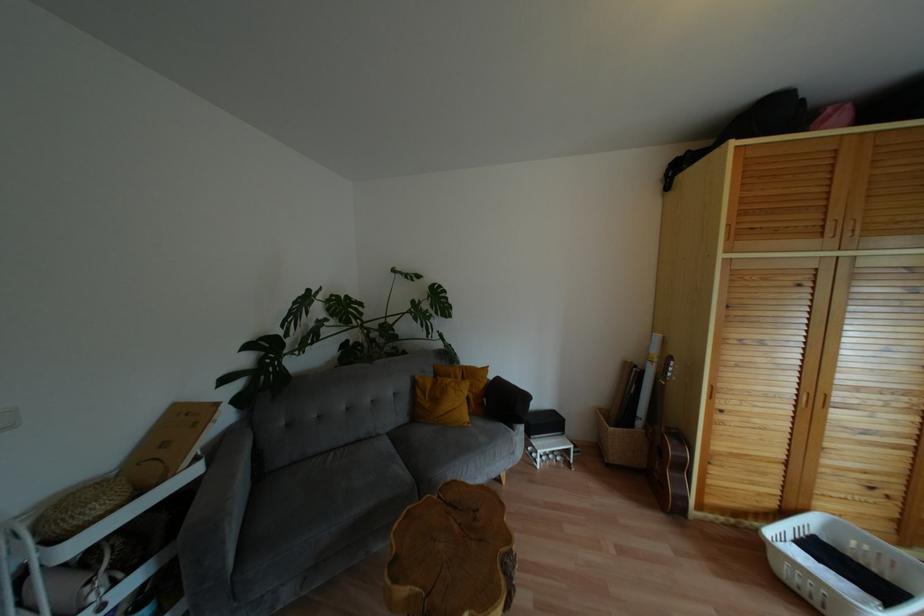
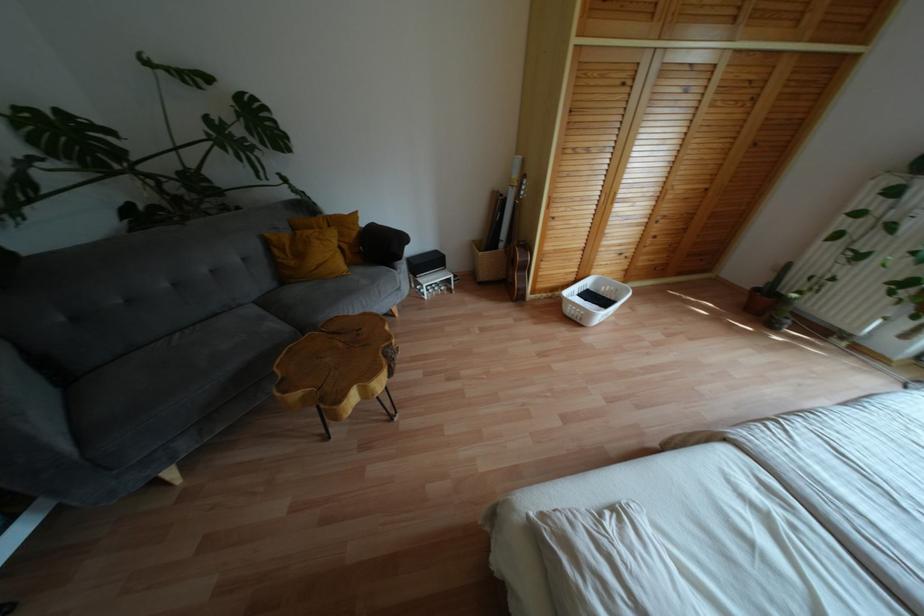
Where in the second image is the point corresponding to point 484,369 from the first image?

(354, 214)